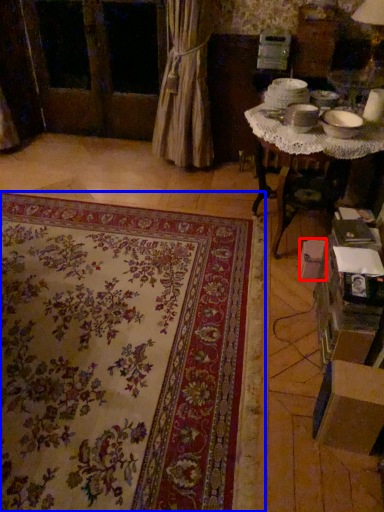
Question: Which object is further to the camera taking this photo, cardboard box (highlighted by a red box) or mat (highlighted by a blue box)?

Choices:
 (A) cardboard box
 (B) mat

Answer: (A)